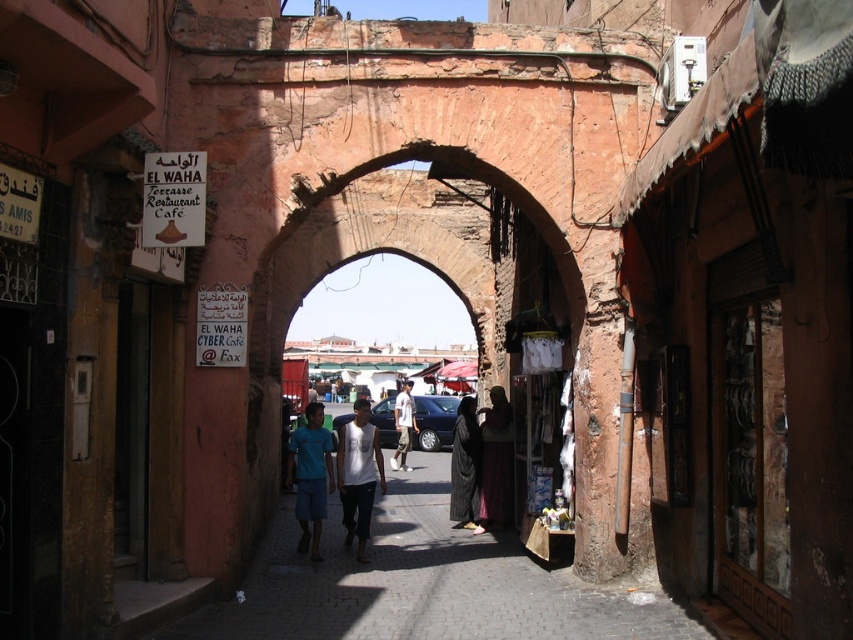
Between rustic stone archway at center and light brown cotton shirt at center, which one appears on the right side from the viewer's perspective?

rustic stone archway at center is more to the right.

Between point (471, 170) and point (407, 410), which one is positioned in front?

Point (471, 170) is in front.

Locate an element on the screen. The width and height of the screenshot is (853, 640). rustic stone archway at center is located at coordinates (363, 257).

From the picture: Is smooth stone pavement at center bigger than rustic stone archway at center?

No, smooth stone pavement at center is not bigger than rustic stone archway at center.

Image resolution: width=853 pixels, height=640 pixels. Describe the element at coordinates (422, 582) in the screenshot. I see `smooth stone pavement at center` at that location.

Locate an element on the screen. The height and width of the screenshot is (640, 853). smooth stone pavement at center is located at coordinates (422, 582).

From the picture: Is blue cotton shirt at center shorter than light brown cotton shirt at center?

No, blue cotton shirt at center is not shorter than light brown cotton shirt at center.

Who is positioned more to the right, blue cotton shirt at center or light brown cotton shirt at center?

light brown cotton shirt at center is more to the right.

This screenshot has width=853, height=640. Identify the location of blue cotton shirt at center. (310, 476).

In order to click on blue cotton shirt at center in this screenshot , I will do `click(310, 476)`.